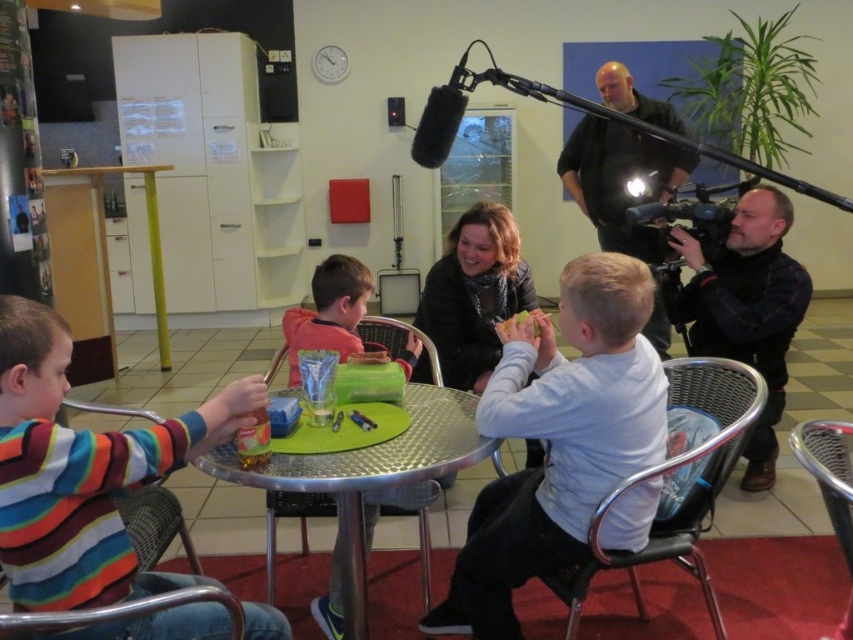
Is point (61, 541) positioned before point (618, 157)?

Yes, point (61, 541) is in front of point (618, 157).

Can you confirm if striped cotton shirt at left is smaller than dark gray shirt at upper right?

Correct, striped cotton shirt at left occupies less space than dark gray shirt at upper right.

Is point (68, 477) more distant than point (659, 195)?

No, (68, 477) is in front of (659, 195).

Identify the location of striped cotton shirt at left. The image size is (853, 640). (83, 472).

Can you confirm if striped cotton shirt at left is taller than metallic silver table at center?

Yes, striped cotton shirt at left is taller than metallic silver table at center.

Who is shorter, striped cotton shirt at left or metallic silver table at center?

Standing shorter between the two is metallic silver table at center.

Is point (194, 444) farther from camera compared to point (286, 456)?

No, it is in front of (286, 456).

Locate an element on the screen. Image resolution: width=853 pixels, height=640 pixels. striped cotton shirt at left is located at coordinates (83, 472).

Which is above, white matte shirt at center or metallic silver table at center?

white matte shirt at center

Does white matte shirt at center have a larger size compared to metallic silver table at center?

Correct, white matte shirt at center is larger in size than metallic silver table at center.

At what (x,y) coordinates should I click in order to perform the action: click on white matte shirt at center. Please return your answer as a coordinate pair (x, y). This screenshot has height=640, width=853. Looking at the image, I should click on (558, 438).